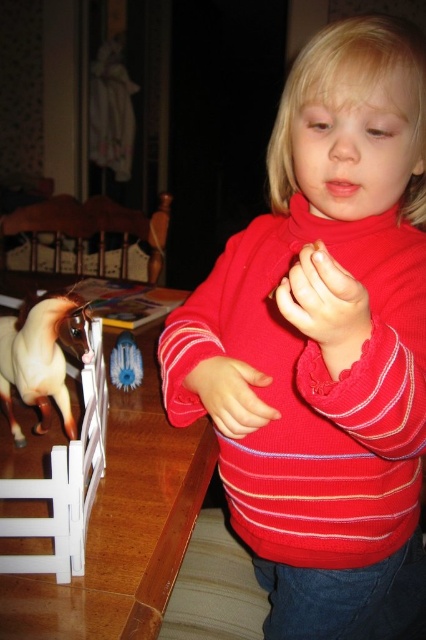
Question: Which object is farther from the camera taking this photo?

Choices:
 (A) brown wooden table at lower left
 (B) brown glossy horse at left
 (C) red striped sweater at center

Answer: (B)

Question: Which point is farther to the camera?

Choices:
 (A) brown glossy horse at left
 (B) red striped sweater at center
 (C) brown wooden table at lower left

Answer: (A)

Question: Estimate the real-world distances between objects in this image. Which object is closer to the red striped sweater at center?

Choices:
 (A) brown wooden table at lower left
 (B) brown glossy horse at left

Answer: (A)

Question: Does red striped sweater at center have a larger size compared to brown wooden table at lower left?

Choices:
 (A) yes
 (B) no

Answer: (B)

Question: Is red striped sweater at center smaller than brown glossy horse at left?

Choices:
 (A) yes
 (B) no

Answer: (B)

Question: Does red striped sweater at center have a lesser width compared to brown glossy horse at left?

Choices:
 (A) no
 (B) yes

Answer: (A)